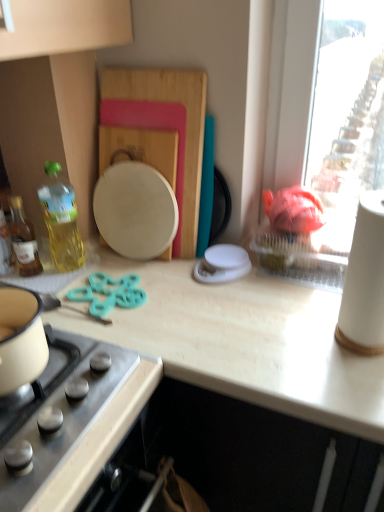
Question: Should I look upward or downward to see translucent yellow bottle at left, the 1th bottle viewed from the right?

Choices:
 (A) down
 (B) up

Answer: (B)

Question: Does white paper towel at right come behind stainless steel gas stove at lower left?

Choices:
 (A) no
 (B) yes

Answer: (B)

Question: Considering the relative sizes of white paper towel at right and stainless steel gas stove at lower left in the image provided, is white paper towel at right bigger than stainless steel gas stove at lower left?

Choices:
 (A) yes
 (B) no

Answer: (B)

Question: Is white paper towel at right next to stainless steel gas stove at lower left and touching it?

Choices:
 (A) no
 (B) yes

Answer: (A)

Question: Can you confirm if white paper towel at right is positioned to the left of stainless steel gas stove at lower left?

Choices:
 (A) no
 (B) yes

Answer: (A)

Question: From a real-world perspective, is white paper towel at right beneath stainless steel gas stove at lower left?

Choices:
 (A) no
 (B) yes

Answer: (A)

Question: Can you confirm if white paper towel at right is thinner than stainless steel gas stove at lower left?

Choices:
 (A) no
 (B) yes

Answer: (B)

Question: Considering the relative sizes of translucent yellow bottle at left, the 2th bottle positioned from the right, and white paper towel at right in the image provided, is translucent yellow bottle at left, the 2th bottle positioned from the right, taller than white paper towel at right?

Choices:
 (A) yes
 (B) no

Answer: (B)

Question: Is translucent yellow bottle at left, acting as the 1th bottle starting from the left, next to white paper towel at right and touching it?

Choices:
 (A) no
 (B) yes

Answer: (A)

Question: Does translucent yellow bottle at left, the 2th bottle positioned from the right, have a larger size compared to white paper towel at right?

Choices:
 (A) no
 (B) yes

Answer: (A)

Question: From the image's perspective, is translucent yellow bottle at left, acting as the 1th bottle starting from the left, under white paper towel at right?

Choices:
 (A) no
 (B) yes

Answer: (A)

Question: Is translucent yellow bottle at left, acting as the 1th bottle starting from the left, located outside white paper towel at right?

Choices:
 (A) no
 (B) yes

Answer: (B)

Question: Would you consider translucent yellow bottle at left, the 2th bottle positioned from the right, to be distant from white paper towel at right?

Choices:
 (A) no
 (B) yes

Answer: (A)

Question: Can you confirm if translucent yellow bottle at left, the 2th bottle positioned from the right, is bigger than light wood countertop at center?

Choices:
 (A) no
 (B) yes

Answer: (A)